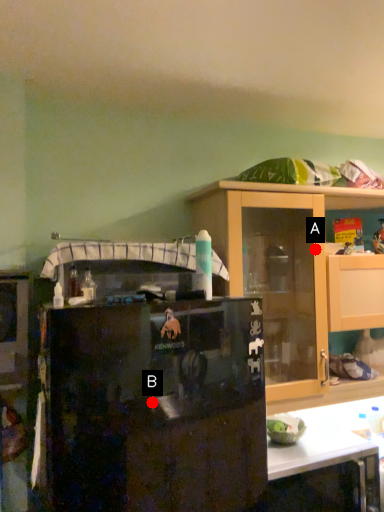
Question: Two points are circled on the image, labeled by A and B beside each circle. Which point is further to the camera?

Choices:
 (A) A is further
 (B) B is further

Answer: (A)